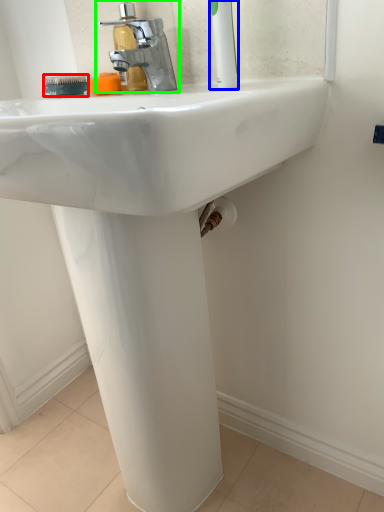
Question: Which object is the farthest from brush (highlighted by a red box)? Choose among these: toothbrush (highlighted by a blue box) or tap (highlighted by a green box).

Choices:
 (A) toothbrush
 (B) tap

Answer: (A)